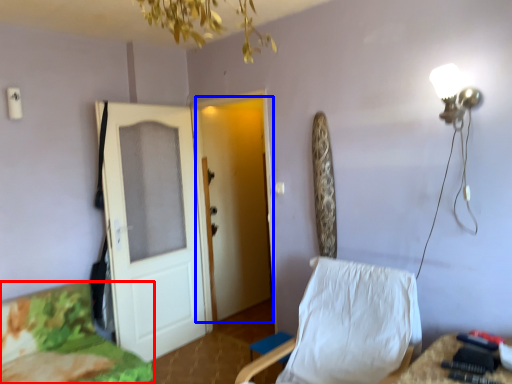
Question: Among these objects, which one is farthest to the camera, furniture (highlighted by a red box) or door (highlighted by a blue box)?

Choices:
 (A) furniture
 (B) door

Answer: (B)